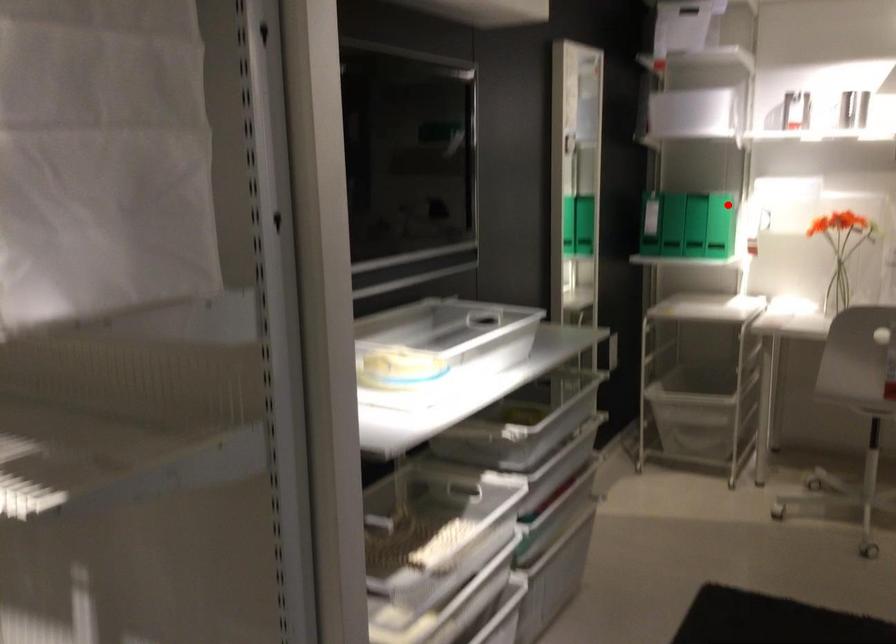
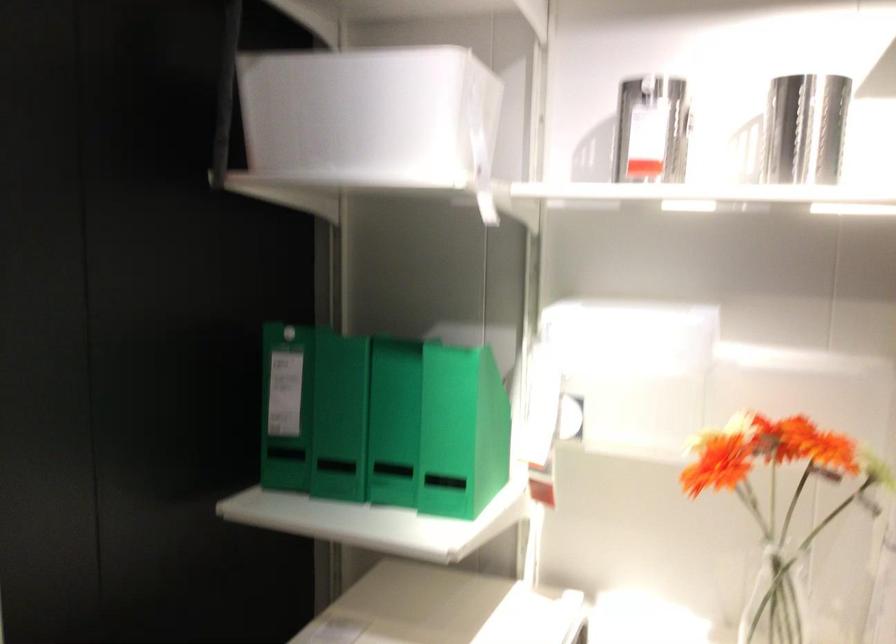
Where in the second image is the point corresponding to the highlighted location from the first image?

(392, 422)